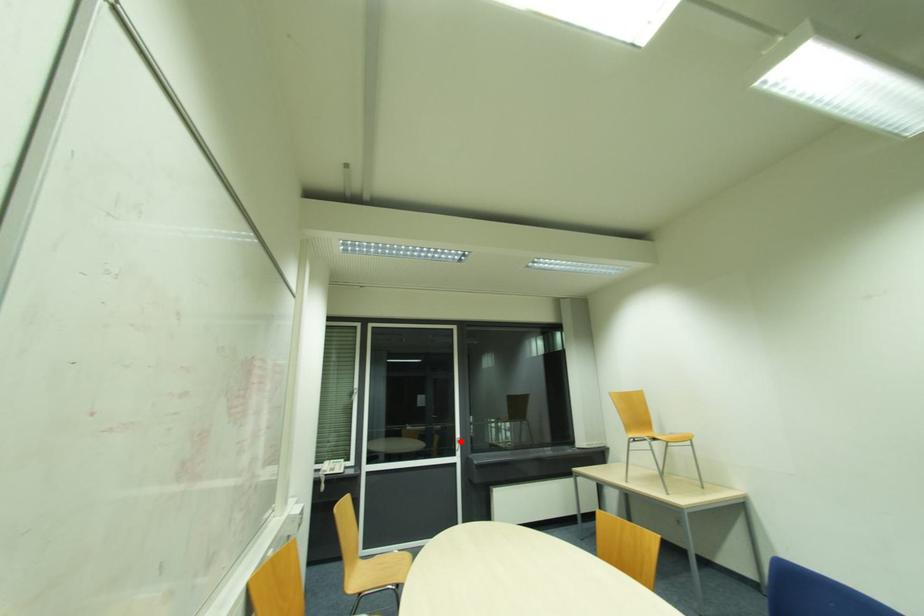
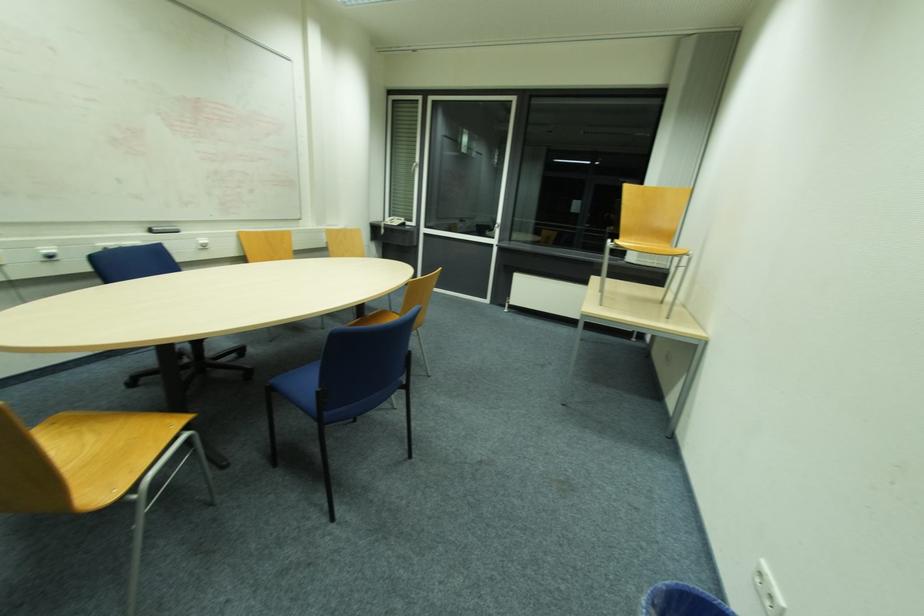
Question: A red point is marked in image1. In image2, is the corresponding 3D point closer to the camera or farther? Reply with the corresponding letter.

Choices:
 (A) The corresponding 3D point is closer.
 (B) The corresponding 3D point is farther.

Answer: (A)